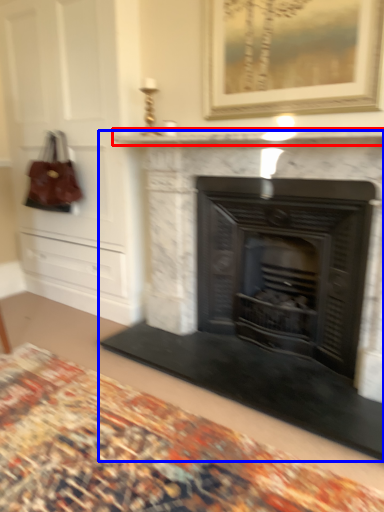
Question: Among these objects, which one is nearest to the camera, mantle (highlighted by a red box) or fireplace (highlighted by a blue box)?

Choices:
 (A) mantle
 (B) fireplace

Answer: (A)